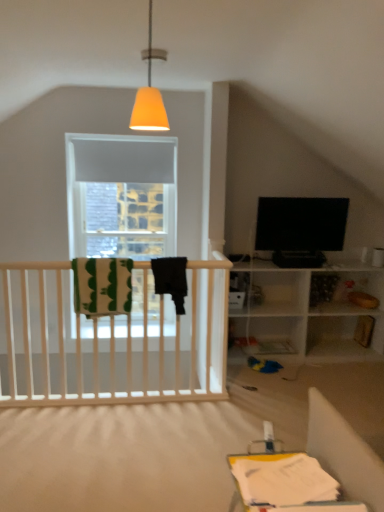
Question: Considering their positions, is matte orange cone at upper center located in front of or behind green striped blanket at left?

Choices:
 (A) front
 (B) behind

Answer: (A)

Question: Is matte orange cone at upper center to the left or to the right of green striped blanket at left in the image?

Choices:
 (A) right
 (B) left

Answer: (A)

Question: Which object is positioned farthest from the matte orange cone at upper center?

Choices:
 (A) black glossy tv at upper right
 (B) green striped blanket at left

Answer: (A)

Question: Which is farther from the green striped blanket at left?

Choices:
 (A) matte orange cone at upper center
 (B) black glossy tv at upper right

Answer: (A)